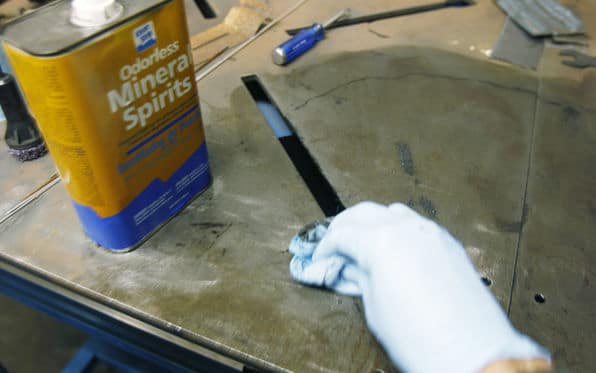
This screenshot has width=596, height=373. In order to click on blue table legs in this screenshot , I will do `click(97, 347)`.